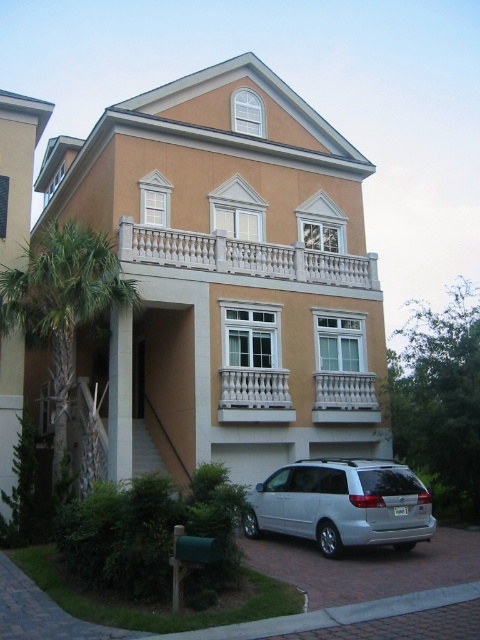
Is green leafy palm tree at left thinner than white stone balcony at upper center?

Indeed, green leafy palm tree at left has a lesser width compared to white stone balcony at upper center.

Based on the photo, does green leafy palm tree at left appear on the right side of white stone balcony at upper center?

In fact, green leafy palm tree at left is to the left of white stone balcony at upper center.

You are a GUI agent. You are given a task and a screenshot of the screen. Output one action in this format:
    pyautogui.click(x=<x>, y=<y>)
    Task: Click on the green leafy palm tree at left
    Image resolution: width=480 pixels, height=640 pixels.
    Given the screenshot: What is the action you would take?
    pyautogui.click(x=61, y=301)

Can you confirm if satin silver minivan at lower right is positioned above green leafy palm tree at left?

Actually, satin silver minivan at lower right is below green leafy palm tree at left.

Does satin silver minivan at lower right appear under green leafy palm tree at left?

Indeed, satin silver minivan at lower right is positioned under green leafy palm tree at left.

Locate an element on the screen. The image size is (480, 640). satin silver minivan at lower right is located at coordinates (342, 504).

Who is taller, green leafy palm tree at left or white marble balustrade at center?

white marble balustrade at center

Does green leafy palm tree at left appear on the right side of white marble balustrade at center?

Incorrect, green leafy palm tree at left is not on the right side of white marble balustrade at center.

What do you see at coordinates (61, 301) in the screenshot?
I see `green leafy palm tree at left` at bounding box center [61, 301].

The image size is (480, 640). In order to click on green leafy palm tree at left in this screenshot , I will do `click(61, 301)`.